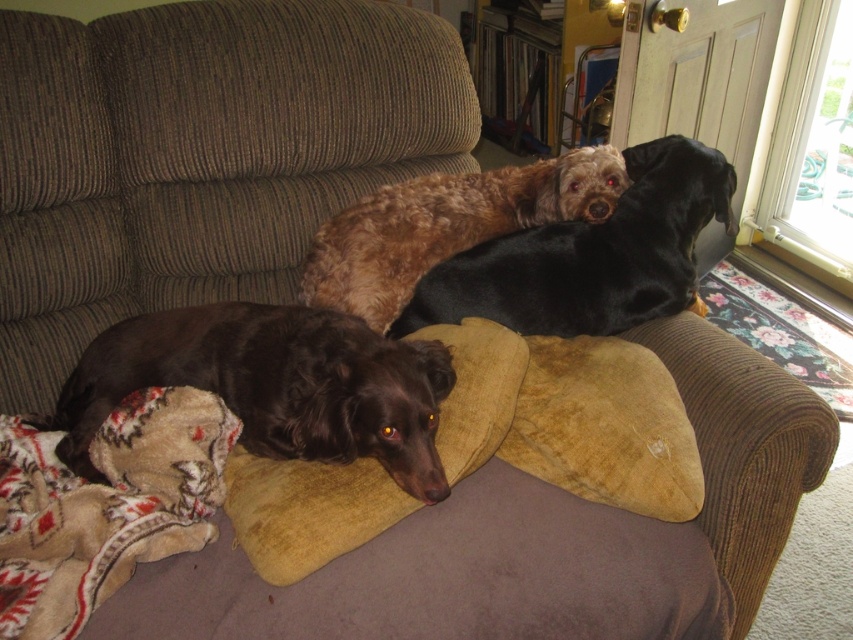
You are standing in front of the couch and want to pet the shaggy brown dog at upper center. Considering your height is 1.6 meters, will you be able to reach the dog without needing a stool?

The shaggy brown dog at upper center is 1.44 meters away from the viewer, so yes, you can reach it without needing a stool since the distance is less than your height of 1.6 meters.